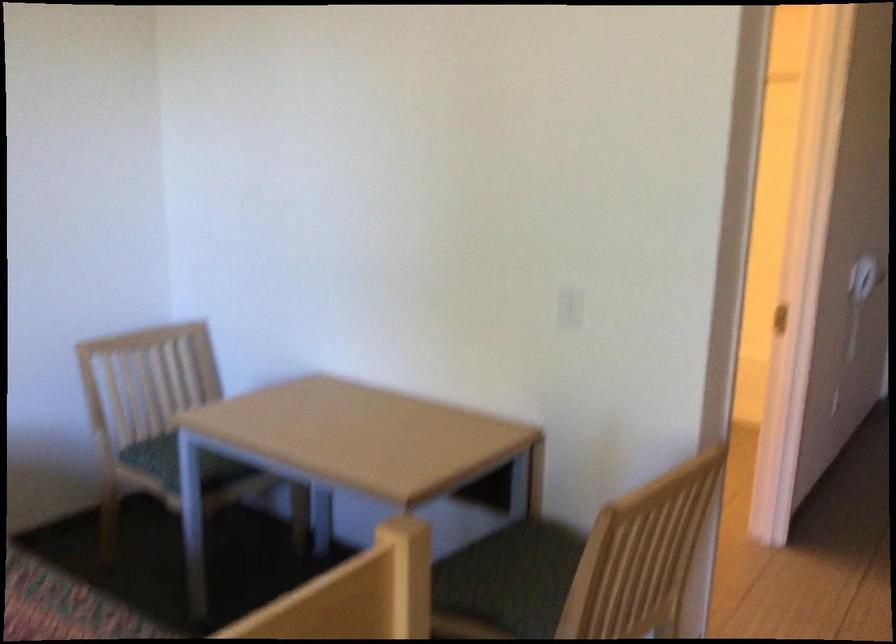
Which object does [570,307] point to?

It refers to a white electrical outlet.